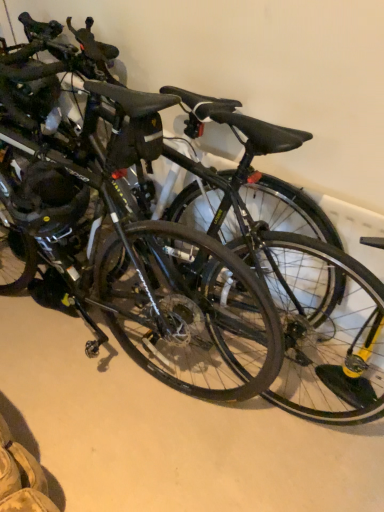
Question: Which direction should I rotate to face black rubber tire at center, acting as the 2th bicycle wheel starting from the left, — up or down?

Choices:
 (A) up
 (B) down

Answer: (A)

Question: Is matte black helmet at left, which ranks as the first bicycle wheel in left-to-right order, thinner than black rubber tire at center, acting as the 2th bicycle wheel starting from the left?

Choices:
 (A) yes
 (B) no

Answer: (B)

Question: Would you say matte black helmet at left, which ranks as the first bicycle wheel in left-to-right order, contains black rubber tire at center, acting as the first bicycle wheel starting from the right?

Choices:
 (A) yes
 (B) no

Answer: (B)

Question: Considering the relative positions of matte black helmet at left, acting as the second bicycle wheel starting from the right, and black rubber tire at center, acting as the 2th bicycle wheel starting from the left, in the image provided, is matte black helmet at left, acting as the second bicycle wheel starting from the right, to the left of black rubber tire at center, acting as the 2th bicycle wheel starting from the left, from the viewer's perspective?

Choices:
 (A) no
 (B) yes

Answer: (B)

Question: From the image's perspective, is matte black helmet at left, acting as the second bicycle wheel starting from the right, under black rubber tire at center, acting as the first bicycle wheel starting from the right?

Choices:
 (A) yes
 (B) no

Answer: (B)

Question: Could you tell me if matte black helmet at left, which ranks as the first bicycle wheel in left-to-right order, is facing black rubber tire at center, acting as the 2th bicycle wheel starting from the left?

Choices:
 (A) no
 (B) yes

Answer: (A)

Question: Is matte black helmet at left, acting as the second bicycle wheel starting from the right, next to black rubber tire at center, acting as the first bicycle wheel starting from the right, and touching it?

Choices:
 (A) yes
 (B) no

Answer: (B)

Question: Considering the relative sizes of matte black helmet at left, which ranks as the first bicycle wheel in left-to-right order, and black matte bicycle at center in the image provided, is matte black helmet at left, which ranks as the first bicycle wheel in left-to-right order, shorter than black matte bicycle at center?

Choices:
 (A) yes
 (B) no

Answer: (B)

Question: Is matte black helmet at left, acting as the second bicycle wheel starting from the right, looking in the opposite direction of black matte bicycle at center?

Choices:
 (A) yes
 (B) no

Answer: (B)

Question: Is matte black helmet at left, acting as the second bicycle wheel starting from the right, not within black matte bicycle at center?

Choices:
 (A) no
 (B) yes

Answer: (B)

Question: From a real-world perspective, is matte black helmet at left, which ranks as the first bicycle wheel in left-to-right order, under black matte bicycle at center?

Choices:
 (A) no
 (B) yes

Answer: (A)

Question: Is matte black helmet at left, which ranks as the first bicycle wheel in left-to-right order, closer to camera compared to black matte bicycle at center?

Choices:
 (A) yes
 (B) no

Answer: (B)

Question: From the image's perspective, is matte black helmet at left, which ranks as the first bicycle wheel in left-to-right order, located above black matte bicycle at center?

Choices:
 (A) yes
 (B) no

Answer: (A)

Question: Is glossy black bicycle at center wider than black matte bicycle at center?

Choices:
 (A) yes
 (B) no

Answer: (B)